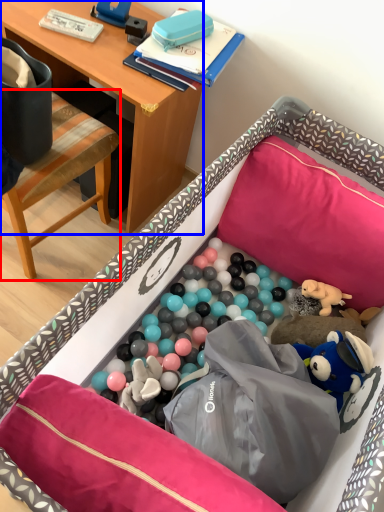
Question: Which object appears closest to the camera in this image, chair (highlighted by a red box) or desk (highlighted by a blue box)?

Choices:
 (A) chair
 (B) desk

Answer: (A)